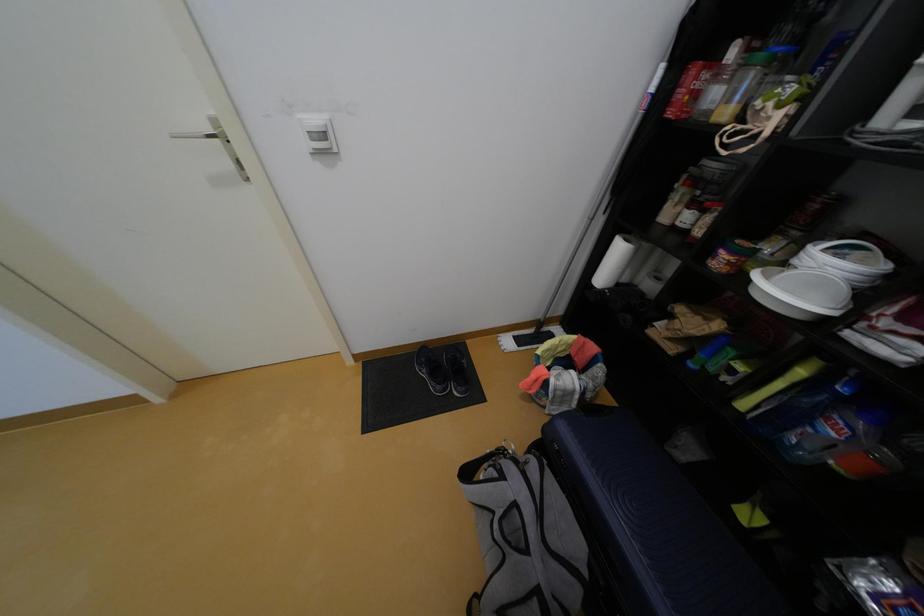
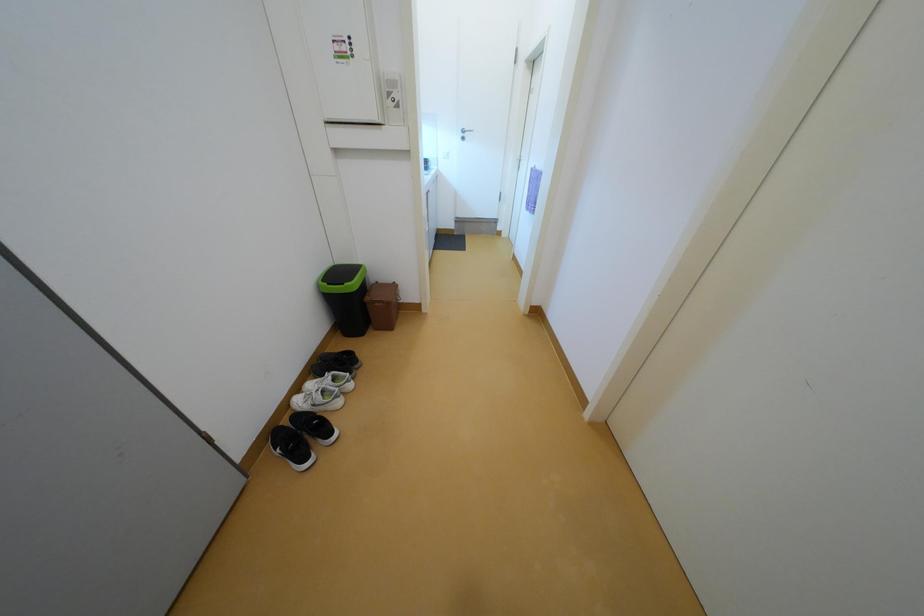
In the scene shown: Based on the continuous images, in which direction is the camera rotating?

The rotation direction of the camera is left-down.